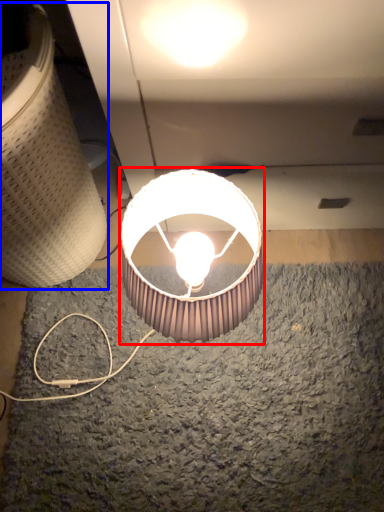
Question: Which object is further to the camera taking this photo, lamp (highlighted by a red box) or lamp (highlighted by a blue box)?

Choices:
 (A) lamp
 (B) lamp

Answer: (A)